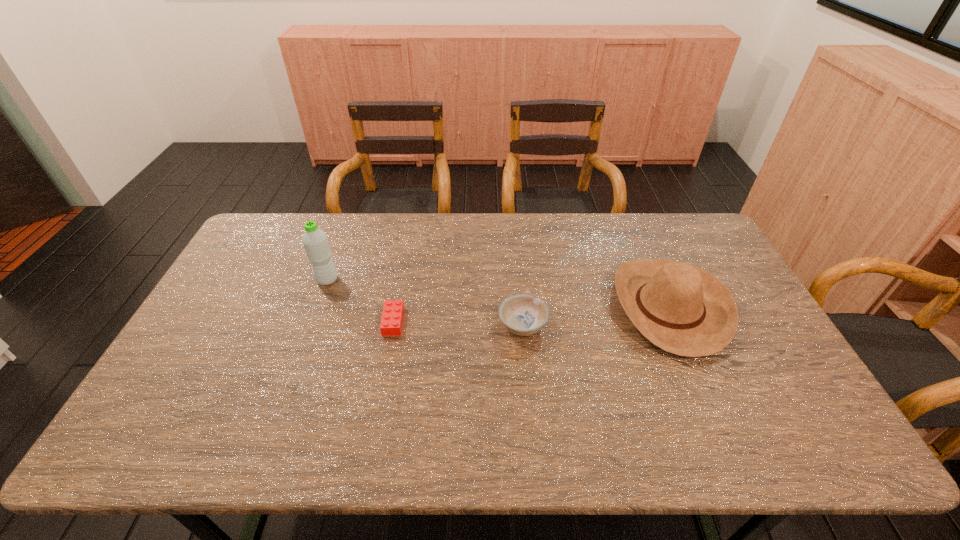
At what (x,y) coordinates should I click in order to perform the action: click on the leftmost object. Please return your answer as a coordinate pair (x, y). This screenshot has height=540, width=960. Looking at the image, I should click on (315, 241).

The image size is (960, 540). I want to click on water bottle, so click(315, 241).

Identify the location of the second tallest object. (683, 309).

Identify the location of cowboy hat. The image size is (960, 540). (683, 309).

Locate an element on the screen. the third object from left to right is located at coordinates (522, 314).

This screenshot has width=960, height=540. Identify the location of the third tallest object. (522, 314).

Find the location of a particular element. The image size is (960, 540). the shortest object is located at coordinates (392, 317).

Locate an element on the screen. Lego is located at coordinates (392, 317).

Image resolution: width=960 pixels, height=540 pixels. I want to click on free space located 0.080m on the front of the leftmost object, so click(x=318, y=306).

Where is `vacant space located 0.110m on the front-facing side of the third shortest object`? vacant space located 0.110m on the front-facing side of the third shortest object is located at coordinates (577, 307).